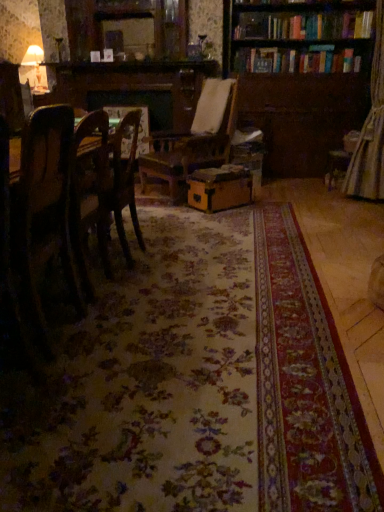
Question: Do you think wooden bookcase at upper right is within wooden chair at left, or outside of it?

Choices:
 (A) inside
 (B) outside

Answer: (B)

Question: Is point (276, 103) positioned closer to the camera than point (52, 192)?

Choices:
 (A) closer
 (B) farther

Answer: (B)

Question: Which object is the closest to the wooden chair at left?

Choices:
 (A) wooden bookcase at upper right
 (B) matte brown cardboard box at center

Answer: (B)

Question: Which of these objects is positioned closest to the wooden chair at left?

Choices:
 (A) matte brown cardboard box at center
 (B) wooden bookcase at upper right

Answer: (A)